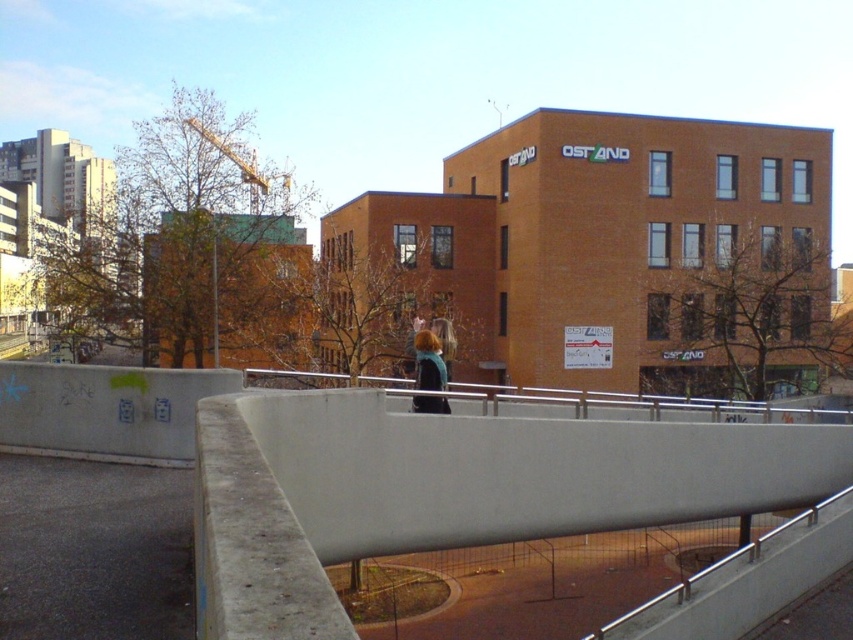
You are a pedestrian standing in front of the building. You see the concrete at center and the blue fabric jacket at center. Which object is closer to your right side?

The concrete at center is to the right of the blue fabric jacket at center, so the concrete at center is closer to your right side.

You are a delivery robot with a package that needs to be placed between the concrete at center and the blue fabric jacket at center. Can you fit the package, which is 1.5 meters long, in that space?

The space between the concrete at center and the blue fabric jacket at center is 1.35 meters, so the 1.5 meter long package cannot fit in that space.

Please provide the 2D coordinates of the concrete at center in the image. The coordinates should be in the format of a point with two decimal places, like point x, y.

The 2D coordinates of the concrete at center are point (253, 536).